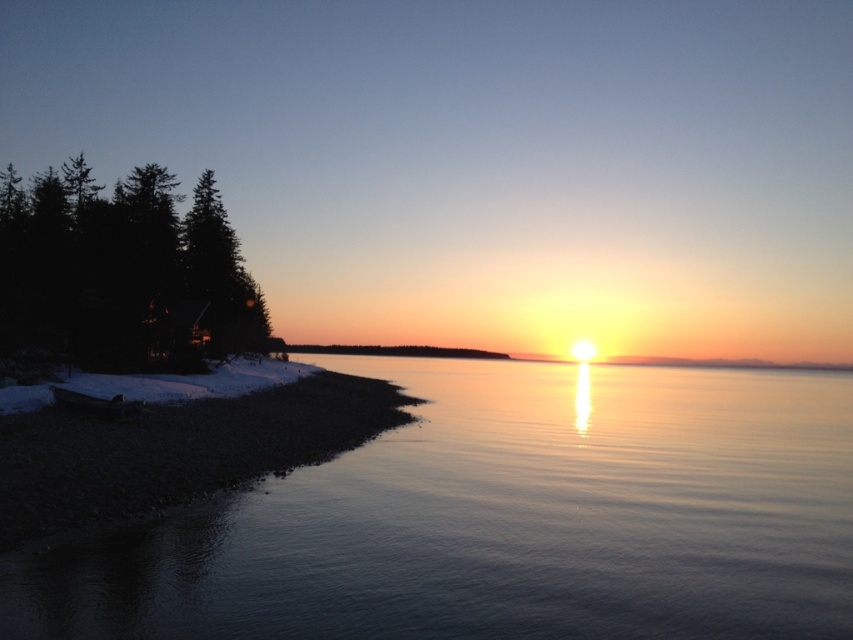
You are standing at the smooth gravel shoreline at lower left and want to take a photo of the dark green textured trees at left. Since the trees are much taller than the shoreline, where should you position yourself to capture the entire trees in your camera frame?

Since the dark green textured trees at left are much taller than the smooth gravel shoreline at lower left, you should position yourself further back from the trees to ensure they fit entirely within your camera frame.

You are an artist trying to paint the sunset scene. You want to ensure the smooth reflective water at center and the dark green textured trees at left are positioned correctly. According to the scene, which object is located to the right of the other?

The smooth reflective water at center is to the right of dark green textured trees at left.

You are standing at the point with coordinates 0.6, 0.6 in the image. You want to walk towards the smooth reflective water at center. Which direction should you move? Please answer with either left, right, up, or down.

You should move down because the smooth reflective water at center is located at coordinates (503, 520), which is below your current position at (511, 384).